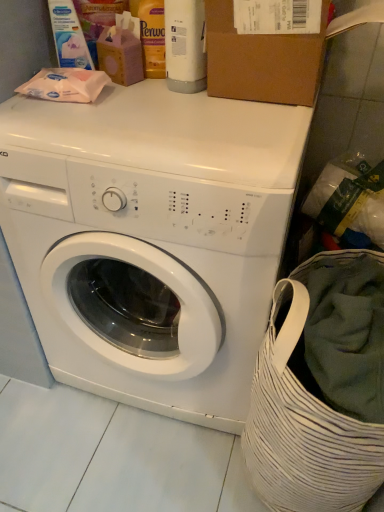
Locate an element on the screen. The width and height of the screenshot is (384, 512). vacant space that is to the left of white glossy bottle at upper center, acting as the second cleaning product starting from the left is located at coordinates (126, 94).